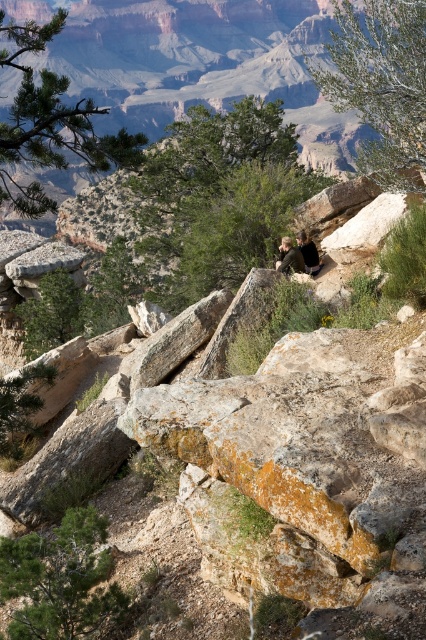
Between green fabric jacket at center and dark brown leather jacket at center, which one is positioned lower?

green fabric jacket at center is lower down.

Does green fabric jacket at center appear on the right side of dark brown leather jacket at center?

No, green fabric jacket at center is not to the right of dark brown leather jacket at center.

Is point (287, 236) behind point (316, 260)?

Yes, point (287, 236) is farther from viewer.

Locate an element on the screen. green fabric jacket at center is located at coordinates (290, 257).